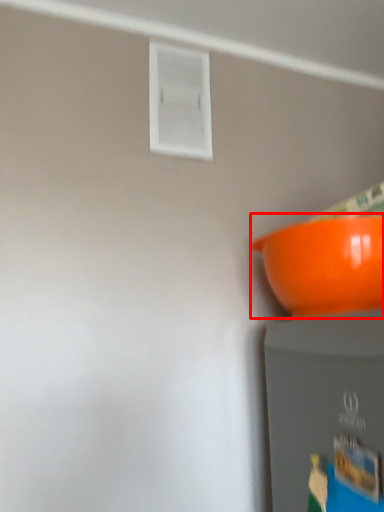
Question: Where is bowl (annotated by the red box) located in relation to window in the image?

Choices:
 (A) right
 (B) left

Answer: (A)